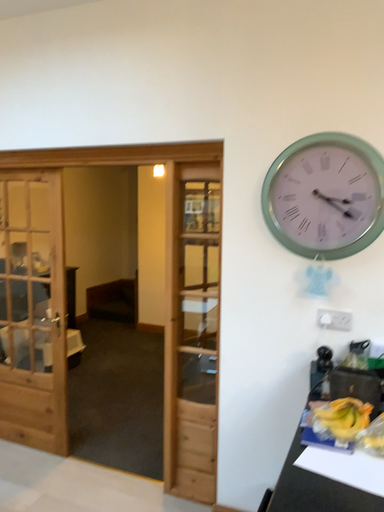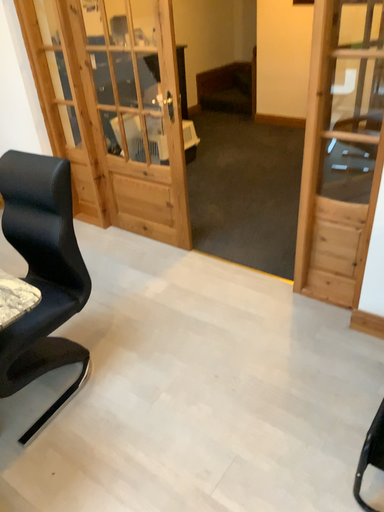
Question: How did the camera likely rotate when shooting the video?

Choices:
 (A) rotated downward
 (B) rotated upward

Answer: (A)